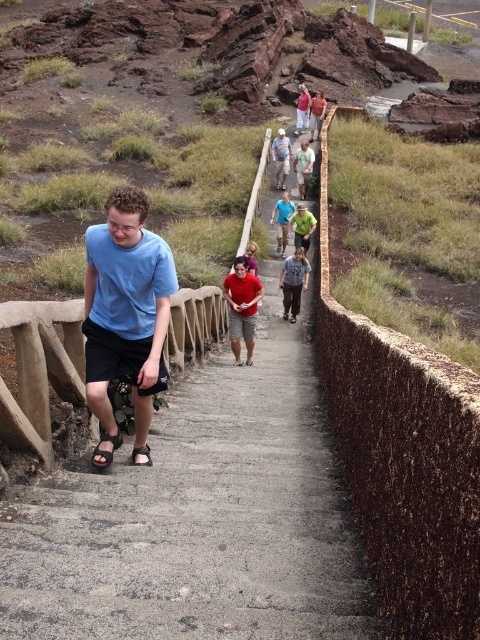
Who is taller, green matte shirt at center or black leather sandal at lower center?

green matte shirt at center

Who is more distant from viewer, [302,209] or [147,448]?

Point [302,209]

The height and width of the screenshot is (640, 480). What do you see at coordinates (302, 227) in the screenshot?
I see `green matte shirt at center` at bounding box center [302, 227].

I want to click on green matte shirt at center, so click(302, 227).

Can you confirm if concrete stairs at center is bigger than matte gray shirt at center?

Correct, concrete stairs at center is larger in size than matte gray shirt at center.

Who is higher up, concrete stairs at center or matte gray shirt at center?

matte gray shirt at center is higher up.

Between point (325, 538) and point (278, 138), which one is positioned behind?

Point (278, 138)

Where is `concrete stairs at center`? The image size is (480, 640). concrete stairs at center is located at coordinates (199, 524).

Who is more distant from viewer, [107,451] or [307,106]?

Point [307,106]

Which of these two, brown leather sandal at lower left or matte red shirt at center, stands taller?

matte red shirt at center

At what (x,y) coordinates should I click in order to perform the action: click on brown leather sandal at lower left. Please return your answer as a coordinate pair (x, y). The height and width of the screenshot is (640, 480). Looking at the image, I should click on (106, 451).